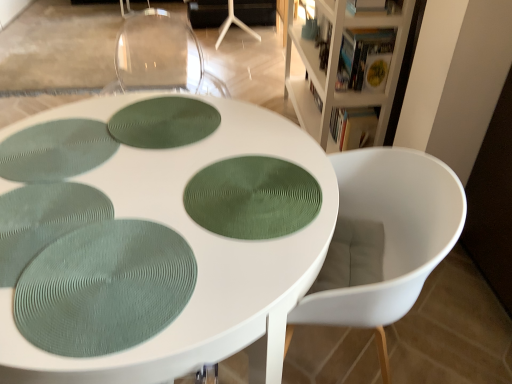
What is the approximate width of white wood bookcase at upper right?

The width of white wood bookcase at upper right is 36.04 centimeters.

Measure the distance between green textured placemat at center, arranged as the 3th oval when ordered from the bottom, and camera.

A distance of 4.43 feet exists between green textured placemat at center, arranged as the 3th oval when ordered from the bottom, and camera.

Where is `green textured placemat at lower left, the first oval from the bottom`? green textured placemat at lower left, the first oval from the bottom is located at coordinates (104, 288).

Identify the location of table on the left of the green textured placemat at center, acting as the 2th oval starting from the front. (154, 236).

Could you measure the distance between green textured placemat at center, acting as the 2th oval starting from the front, and white matte table at center?

green textured placemat at center, acting as the 2th oval starting from the front, is 6.94 inches from white matte table at center.

Is green textured placemat at center, acting as the 2th oval starting from the front, aimed at white matte table at center?

Yes, green textured placemat at center, acting as the 2th oval starting from the front, faces towards white matte table at center.

Based on the photo, who is more distant, green textured placemat at center, acting as the 2th oval starting from the front, or white matte table at center?

Positioned behind is green textured placemat at center, acting as the 2th oval starting from the front.

Image resolution: width=512 pixels, height=384 pixels. Find the location of `the 2nd oval positioned below the green textured placemat at lower left, the first oval from the bottom (from a real-world perspective)`. the 2nd oval positioned below the green textured placemat at lower left, the first oval from the bottom (from a real-world perspective) is located at coordinates (163, 122).

Is green textured placemat at lower left, which is the first oval from front to back, facing away from green textured placemat at center, the 3th oval from the front?

Absolutely, green textured placemat at lower left, which is the first oval from front to back, is directed away from green textured placemat at center, the 3th oval from the front.

Can you tell me how much green textured placemat at lower left, marked as the 3th oval in a back-to-front arrangement, and green textured placemat at center, which ranks as the first oval in top-to-bottom order, differ in facing direction?

green textured placemat at lower left, marked as the 3th oval in a back-to-front arrangement, and green textured placemat at center, which ranks as the first oval in top-to-bottom order, are facing 167 degrees away from each other.

Is green textured placemat at lower left, the 3th oval positioned from the top, further to the viewer compared to green textured placemat at center, the 3th oval from the front?

No, it is in front of green textured placemat at center, the 3th oval from the front.

Is white wood bookcase at upper right next to white plastic chair at lower right?

No, white wood bookcase at upper right is not beside white plastic chair at lower right.

From the image's perspective, would you say white wood bookcase at upper right is positioned over white plastic chair at lower right?

Indeed, from the image's perspective, white wood bookcase at upper right is shown above white plastic chair at lower right.

Which object is more forward, white wood bookcase at upper right or white plastic chair at lower right?

white plastic chair at lower right is in front.

Is white wood bookcase at upper right positioned with its back to white plastic chair at lower right?

No.

Are green textured placemat at center, which ranks as the first oval in top-to-bottom order, and white matte table at center beside each other?

green textured placemat at center, which ranks as the first oval in top-to-bottom order, is not next to white matte table at center, and they're not touching.

From a real-world perspective, is green textured placemat at center, which ranks as the first oval in top-to-bottom order, on white matte table at center?

Yes, from a real-world perspective, green textured placemat at center, which ranks as the first oval in top-to-bottom order, is on top of white matte table at center.

The image size is (512, 384). What are the coordinates of `the 3rd oval behind when counting from the white matte table at center` in the screenshot? It's located at (163, 122).

How many degrees apart are the facing directions of green textured placemat at center, arranged as the 3th oval when ordered from the bottom, and white matte table at center?

17.2 degrees separate the facing orientations of green textured placemat at center, arranged as the 3th oval when ordered from the bottom, and white matte table at center.

Is white matte table at center wider than green textured placemat at center, acting as the second oval starting from the back?

Correct, the width of white matte table at center exceeds that of green textured placemat at center, acting as the second oval starting from the back.

Considering the sizes of white matte table at center and green textured placemat at center, acting as the 2th oval starting from the front, in the image, is white matte table at center taller or shorter than green textured placemat at center, acting as the 2th oval starting from the front,?

In the image, white matte table at center appears to be taller than green textured placemat at center, acting as the 2th oval starting from the front.

How distant is white matte table at center from green textured placemat at center, positioned as the second oval in bottom-to-top order?

white matte table at center and green textured placemat at center, positioned as the second oval in bottom-to-top order, are 6.94 inches apart from each other.

Between white matte table at center and green textured placemat at center, positioned as the second oval in top-to-bottom order, which one is positioned behind?

green textured placemat at center, positioned as the second oval in top-to-bottom order, is further from the camera.

Could you tell me if white matte table at center is facing white plastic chair at lower right?

No, white matte table at center does not turn towards white plastic chair at lower right.

Which is in front, point (179, 107) or point (407, 201)?

The point (407, 201) is closer.

Identify the location of chair that appears above the white matte table at center (from a real-world perspective). Image resolution: width=512 pixels, height=384 pixels. (383, 240).

Is green textured placemat at lower left, which is the first oval from front to back, positioned in front of white matte table at center?

That is False.

From a real-world perspective, is green textured placemat at lower left, marked as the 3th oval in a back-to-front arrangement, above or below white matte table at center?

green textured placemat at lower left, marked as the 3th oval in a back-to-front arrangement, is situated higher than white matte table at center in the real world.

Is green textured placemat at lower left, which is the first oval from front to back, oriented towards white matte table at center?

Yes, green textured placemat at lower left, which is the first oval from front to back, is oriented towards white matte table at center.

What are the coordinates of `the 2nd oval positioned above the white matte table at center (from a real-world perspective)` in the screenshot? It's located at (252, 198).

Image resolution: width=512 pixels, height=384 pixels. Identify the location of oval that is the 2nd one when counting upward from the green textured placemat at lower left, the first oval from the bottom (from the image's perspective). (163, 122).

Based on the photo, estimate the real-world distances between objects in this image. Which object is further from green textured placemat at center, arranged as the 3th oval when ordered from the bottom, green textured placemat at center, positioned as the second oval in top-to-bottom order, or white plastic chair at lower right?

Based on the image, white plastic chair at lower right appears to be further to green textured placemat at center, arranged as the 3th oval when ordered from the bottom.

From the image, which object appears to be farther from white wood bookcase at upper right, green textured placemat at center, positioned as the second oval in bottom-to-top order, or white matte table at center?

green textured placemat at center, positioned as the second oval in bottom-to-top order, is further to white wood bookcase at upper right.

In the scene shown: Based on their spatial positions, is green textured placemat at lower left, which is the first oval from front to back, or white wood bookcase at upper right further from green textured placemat at center, acting as the 2th oval starting from the front?

white wood bookcase at upper right is positioned further to the anchor green textured placemat at center, acting as the 2th oval starting from the front.

Considering their positions, is green textured placemat at center, which is the 1th oval in back-to-front order, positioned further to white plastic chair at lower right than white wood bookcase at upper right?

white wood bookcase at upper right lies further to white plastic chair at lower right than the other object.

From the image, which object appears to be farther from white plastic chair at lower right, white matte table at center or white wood bookcase at upper right?

white wood bookcase at upper right lies further to white plastic chair at lower right than the other object.

Which object lies further to the anchor point white plastic chair at lower right, green textured placemat at lower left, the 3th oval positioned from the top, or green textured placemat at center, arranged as the 3th oval when ordered from the bottom?

Among the two, green textured placemat at center, arranged as the 3th oval when ordered from the bottom, is located further to white plastic chair at lower right.

Which object lies nearer to the anchor point white plastic chair at lower right, green textured placemat at lower left, which is the first oval from front to back, or white matte table at center?

white matte table at center is positioned closer to the anchor white plastic chair at lower right.

Based on their spatial positions, is green textured placemat at center, which is the 1th oval in back-to-front order, or white plastic chair at lower right further from white wood bookcase at upper right?

white plastic chair at lower right lies further to white wood bookcase at upper right than the other object.

Locate an element on the screen. The width and height of the screenshot is (512, 384). table that lies between white wood bookcase at upper right and white plastic chair at lower right from top to bottom is located at coordinates pos(154,236).

Locate an element on the screen. The width and height of the screenshot is (512, 384). oval between green textured placemat at center, acting as the 2th oval starting from the front, and white wood bookcase at upper right from front to back is located at coordinates (163, 122).

Where is `oval between green textured placemat at center, arranged as the 3th oval when ordered from the bottom, and white plastic chair at lower right`? oval between green textured placemat at center, arranged as the 3th oval when ordered from the bottom, and white plastic chair at lower right is located at coordinates (252, 198).

Locate an element on the screen. oval positioned between green textured placemat at lower left, the first oval from the bottom, and green textured placemat at center, arranged as the 3th oval when ordered from the bottom, from near to far is located at coordinates (252, 198).